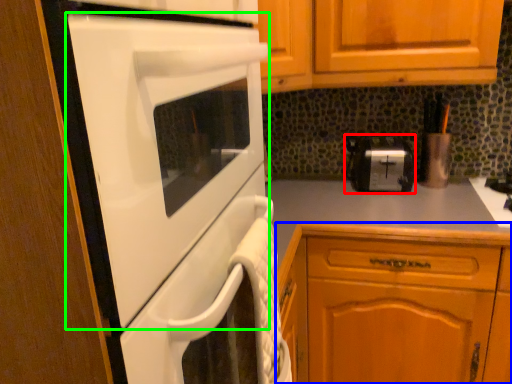
Question: Considering the real-world distances, which object is closest to toaster (highlighted by a red box)? cabinetry (highlighted by a blue box) or home appliance (highlighted by a green box).

Choices:
 (A) cabinetry
 (B) home appliance

Answer: (A)